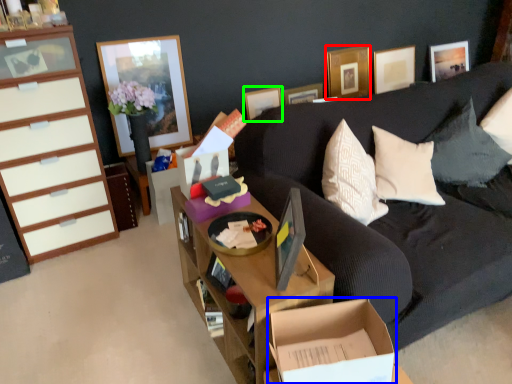
Question: Considering the real-world distances, which object is closest to picture frame (highlighted by a red box)? cardboard box (highlighted by a blue box) or picture frame (highlighted by a green box).

Choices:
 (A) cardboard box
 (B) picture frame

Answer: (B)